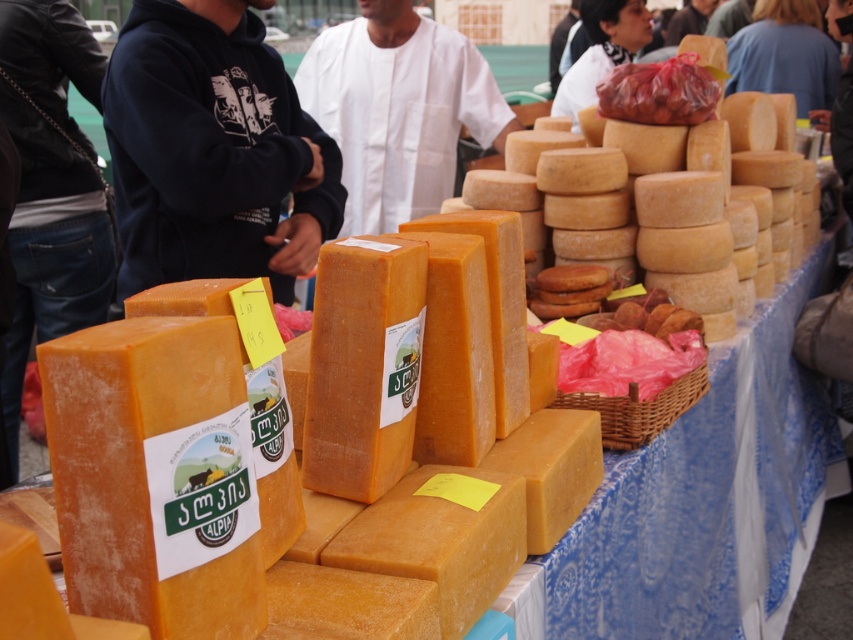
You are a customer at the market and want to place a shiny plastic bag of meat at upper right onto the table. However, there is a white cloth at center covering the table. Where should you put the bag to ensure it sits directly on the table without the cloth?

The white cloth at center is located above the shiny plastic bag of meat at upper right, so to place the bag directly on the table without the cloth, you should position it below the white cloth at center.

Based on the photo, you are a customer at the market and want to know if the orange hard cheese at center will fit into the shiny plastic bag of meat at upper right. Can you determine if it will fit based on their sizes?

The orange hard cheese at center is much taller than the shiny plastic bag of meat at upper right, so it will not fit inside the bag.

You are a customer at the market and want to place a shiny plastic bag of meat at upper right onto the white cloth at center. Will the bag fit on the cloth without hanging off the edges?

The white cloth at center has a greater height compared to shiny plastic bag of meat at upper right, so the bag will fit on the cloth without hanging off the edges since the cloth is taller than the bag.